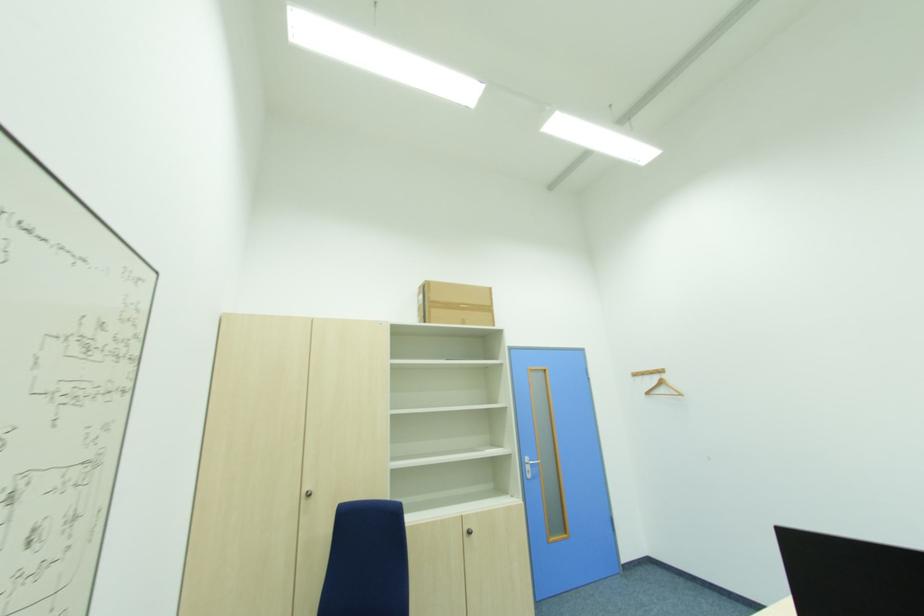
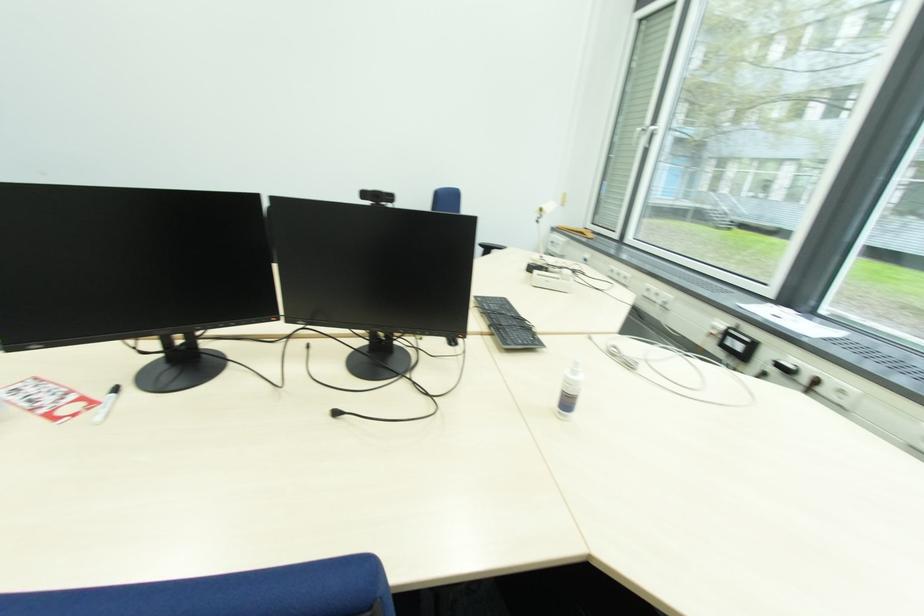
Based on the continuous images, in which direction is the camera rotating?

The camera rotated toward right-down.